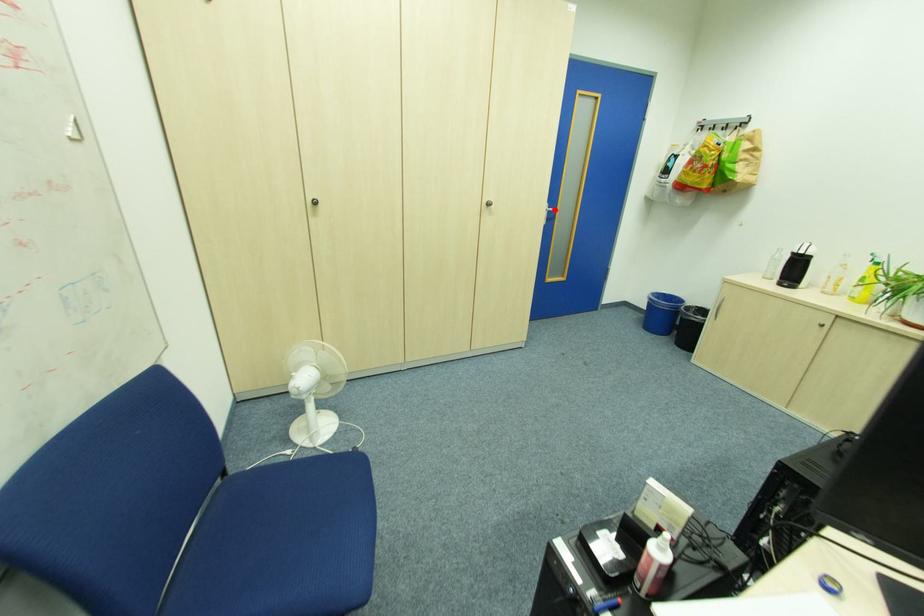
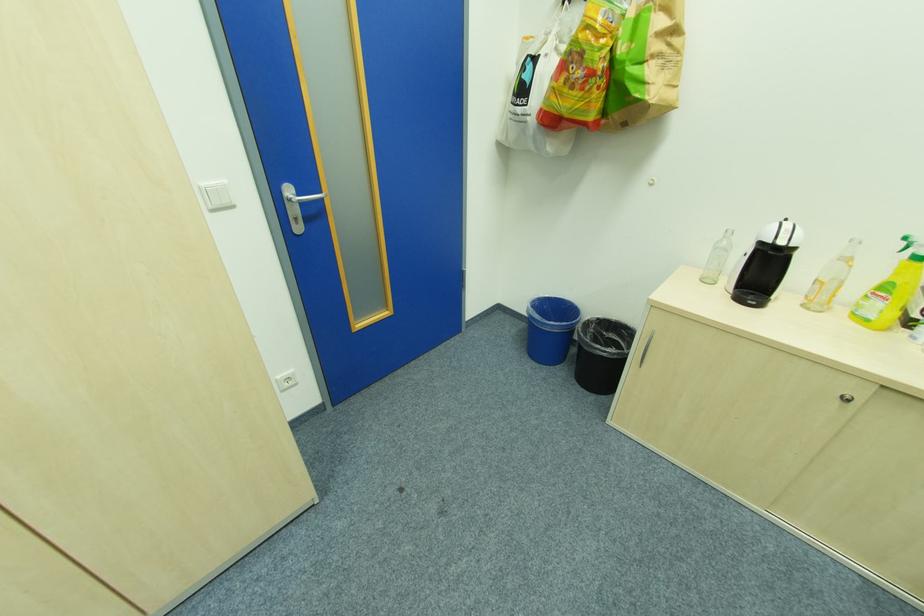
The point at the highlighted location is marked in the first image. Where is the corresponding point in the second image?

(304, 196)